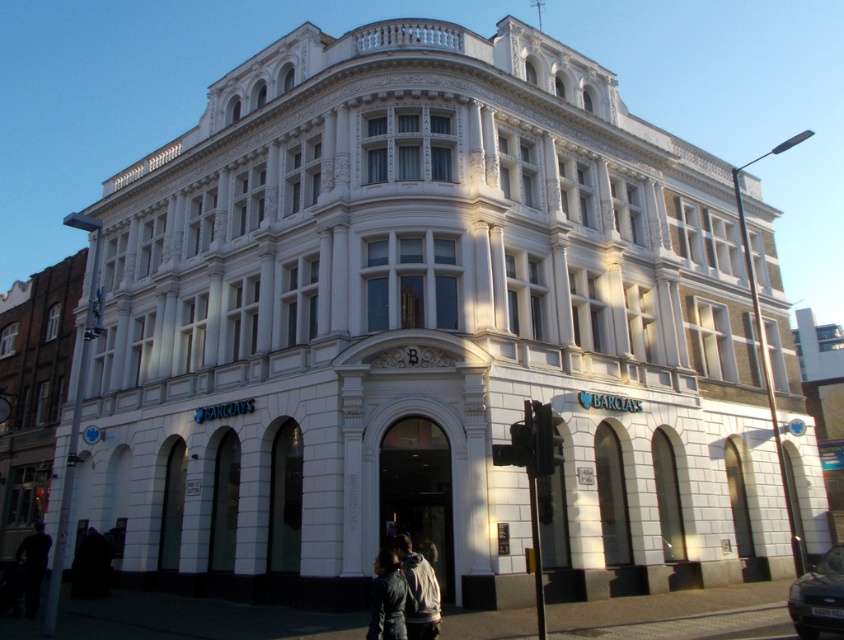
You are standing in front of the Barclays building. You see the white brick building at left and the dark fabric jacket at lower left. Which object is higher in the image?

The white brick building at left is above the dark fabric jacket at lower left, so the white brick building at left is higher in the image.

You are a customer entering the Barclays building and notice two jackets hanging on a rack near the entrance. The jackets are the leather jacket at center and the dark fabric jacket at lower left. Which jacket is closer to you as you approach the entrance?

The leather jacket at center is closer to you because it is in front of the dark fabric jacket at lower left.